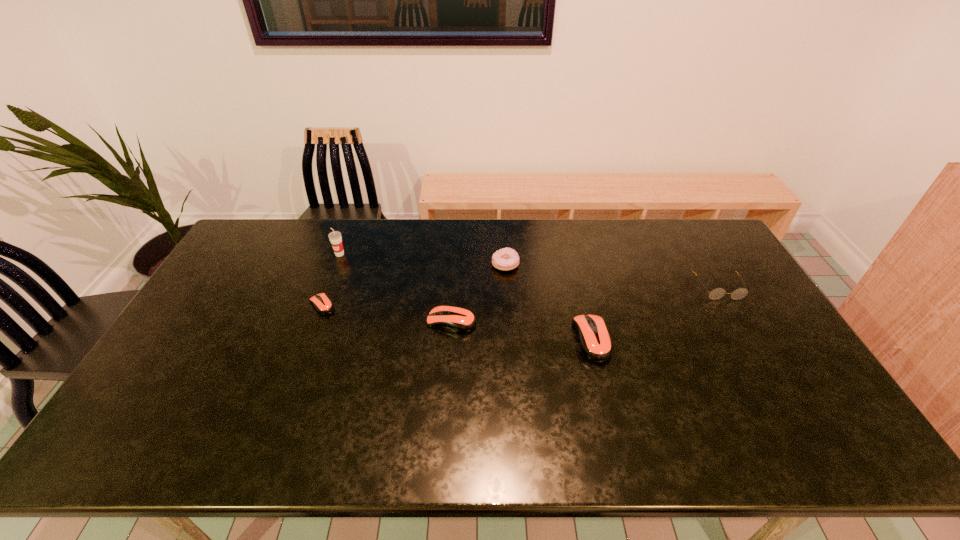
The width and height of the screenshot is (960, 540). I want to click on vacant space at the right edge of the desktop, so click(x=746, y=285).

The height and width of the screenshot is (540, 960). What are the coordinates of `free location at the near right corner` in the screenshot? It's located at click(768, 395).

The width and height of the screenshot is (960, 540). In order to click on empty space between the tallest object and the fourth object from left to right in this screenshot , I will do `click(422, 260)`.

Where is `empty location between the tallest object and the leftmost computer mouse`? The height and width of the screenshot is (540, 960). empty location between the tallest object and the leftmost computer mouse is located at coordinates (331, 280).

Where is `empty space between the cup and the rightmost computer mouse`? The width and height of the screenshot is (960, 540). empty space between the cup and the rightmost computer mouse is located at coordinates (466, 297).

This screenshot has height=540, width=960. Identify the location of vacant area that lies between the second computer mouse from left to right and the shortest object. (387, 313).

Locate an element on the screen. vacant region between the cup and the spectacles is located at coordinates (529, 271).

Identify the location of vacant area that lies between the second computer mouse from left to right and the spectacles. (585, 305).

The width and height of the screenshot is (960, 540). In order to click on free space that is in between the doughnut and the shortest computer mouse in this screenshot , I will do `click(414, 285)`.

Locate an element on the screen. The image size is (960, 540). vacant space that is in between the shortest object and the second computer mouse from left to right is located at coordinates (387, 313).